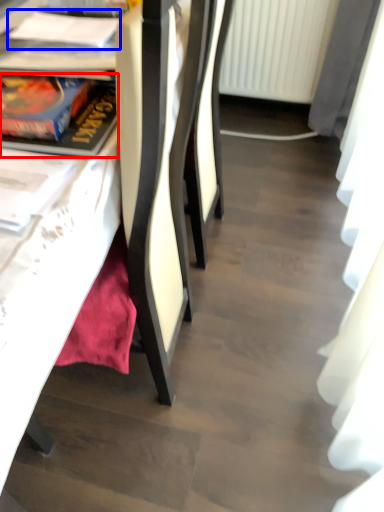
Question: Among these objects, which one is nearest to the camera, book (highlighted by a red box) or book (highlighted by a blue box)?

Choices:
 (A) book
 (B) book

Answer: (A)